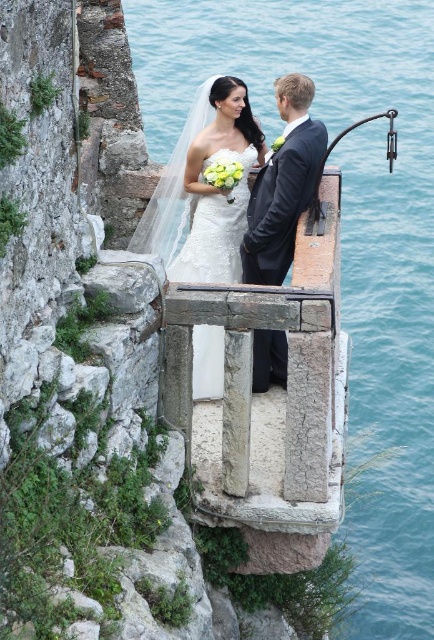
Question: Is blue water at center below satin white dress at center?

Choices:
 (A) no
 (B) yes

Answer: (A)

Question: Estimate the real-world distances between objects in this image. Which object is farther from the satin white dress at center?

Choices:
 (A) matte black suit at center
 (B) blue water at center

Answer: (B)

Question: Is satin white dress at center smaller than matte black suit at center?

Choices:
 (A) yes
 (B) no

Answer: (B)

Question: Which object appears farthest from the camera in this image?

Choices:
 (A) blue water at center
 (B) matte black suit at center

Answer: (A)

Question: Can you confirm if satin white dress at center is positioned to the left of matte black suit at center?

Choices:
 (A) no
 (B) yes

Answer: (B)

Question: Considering the real-world distances, which object is closest to the blue water at center?

Choices:
 (A) satin white dress at center
 (B) matte black suit at center

Answer: (A)